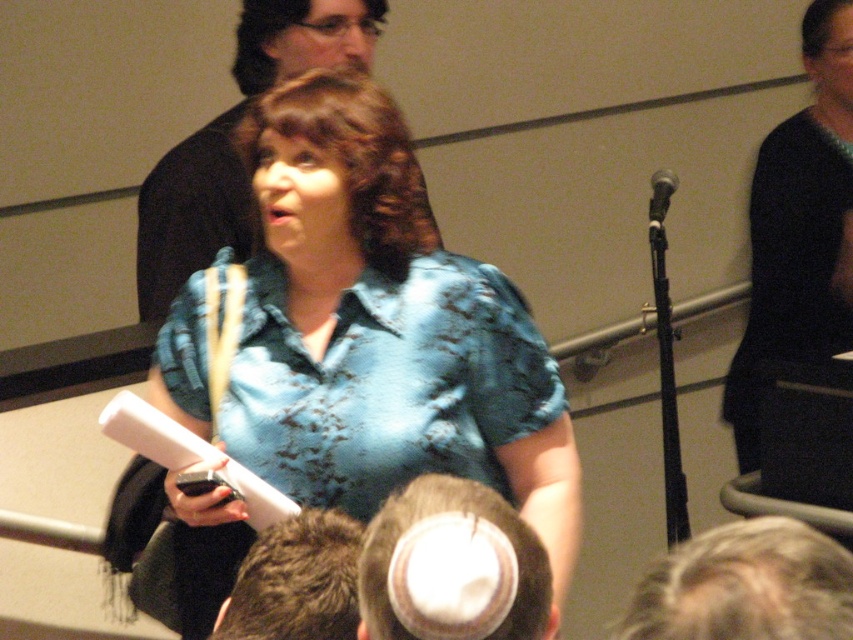
You are a photographer trying to capture a closeup of the two points in the image. Which point, point (483, 580) or point (297, 618), is closer to your camera lens?

Point (483, 580) is closer to the camera than point (297, 618).

You are standing in a classroom and see a point marked at coordinates (x=397, y=260). If you want to place a small book there, will it be within arm reach?

The point at (x=397, y=260) is 5.34 feet away from the viewer, which is beyond typical arm reach. You would need to move closer to place the book there.

You are standing in a classroom and see a point marked at coordinates [792,221]. If you want to place a 10 feet long banner from this point to the back wall, will it fit? Please consider the distance from the point to the viewer.

The distance from the point to the viewer is 8.24 feet. Since the banner is 10 feet long, it will not fit as the available space is shorter than the banner.